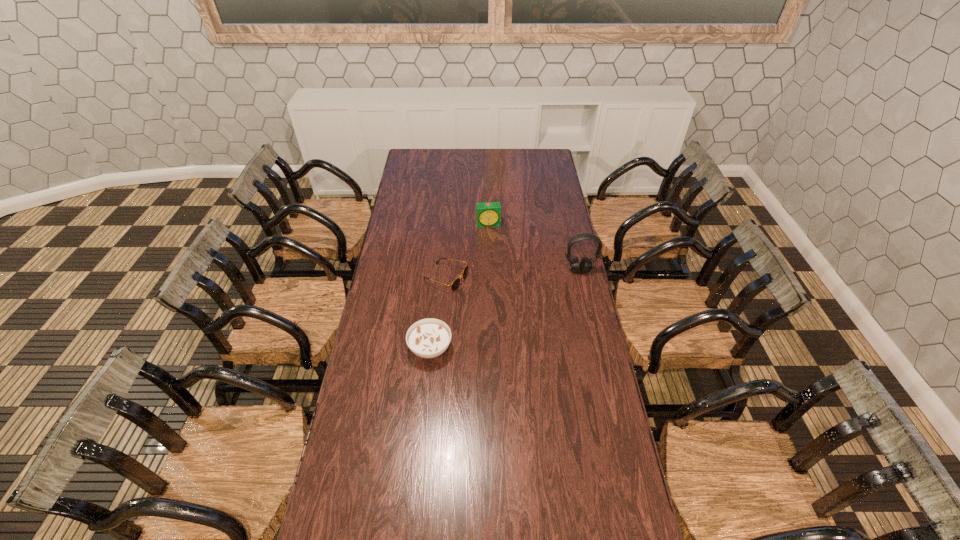
Where is `vacant space at the far right corner of the desktop`? vacant space at the far right corner of the desktop is located at coordinates (553, 168).

The image size is (960, 540). What are the coordinates of `vacant space in between the rightmost object and the farthest object` in the screenshot? It's located at (534, 247).

Identify the location of free spot between the nearest object and the headset. The image size is (960, 540). pyautogui.click(x=505, y=309).

I want to click on free space between the second tallest object and the rightmost object, so click(534, 247).

In order to click on empty space that is in between the second shortest object and the rightmost object in this screenshot , I will do `click(505, 309)`.

Where is `vacant area that lies between the third object from left to right and the shortest object`? This screenshot has height=540, width=960. vacant area that lies between the third object from left to right and the shortest object is located at coordinates (468, 251).

Where is `unoccupied position between the farthest object and the third tallest object`? The height and width of the screenshot is (540, 960). unoccupied position between the farthest object and the third tallest object is located at coordinates (460, 286).

You are a GUI agent. You are given a task and a screenshot of the screen. Output one action in this format:
    pyautogui.click(x=<x>, y=<y>)
    Task: Click on the free space that is in between the alarm clock and the soup bowl
    This screenshot has width=960, height=540.
    Given the screenshot: What is the action you would take?
    pyautogui.click(x=460, y=286)

The width and height of the screenshot is (960, 540). What are the coordinates of `free area in between the tallest object and the shortest object` in the screenshot? It's located at (513, 274).

Identify the location of unoccupied position between the farthest object and the second shortest object. (460, 286).